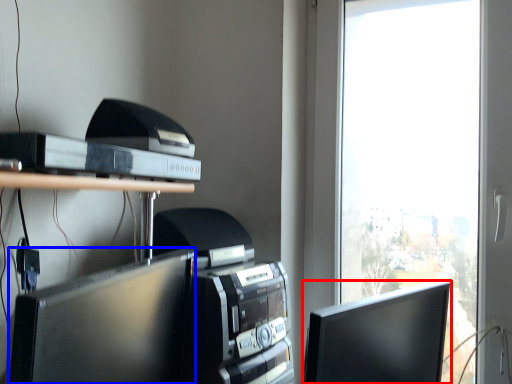
Question: Among these objects, which one is nearest to the camera, computer monitor (highlighted by a red box) or computer monitor (highlighted by a blue box)?

Choices:
 (A) computer monitor
 (B) computer monitor

Answer: (B)